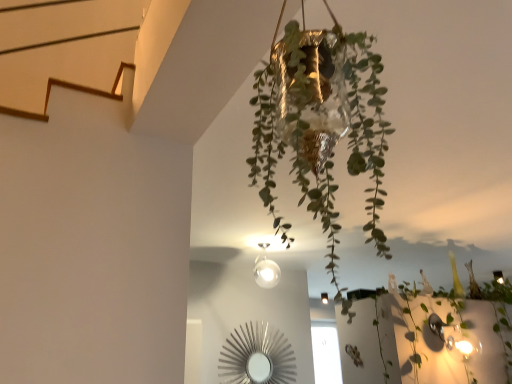
Question: Is green leafy plant at center taller or shorter than gold foil pot at center?

Choices:
 (A) tall
 (B) short

Answer: (B)

Question: Considering their positions, is green leafy plant at center located in front of or behind gold foil pot at center?

Choices:
 (A) front
 (B) behind

Answer: (B)

Question: Based on their relative distances, which object is farther from the green leafy plant at center?

Choices:
 (A) matte white glass light fixture at center
 (B) gold foil pot at center

Answer: (B)

Question: Which of these objects is positioned farthest from the green leafy plant at center?

Choices:
 (A) gold foil pot at center
 (B) matte white glass light fixture at center

Answer: (A)